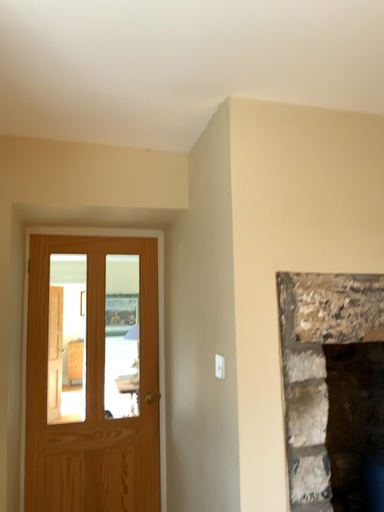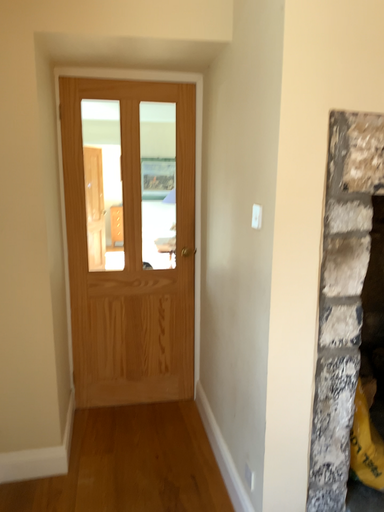
Question: Which way did the camera rotate in the video?

Choices:
 (A) rotated upward
 (B) rotated downward

Answer: (B)